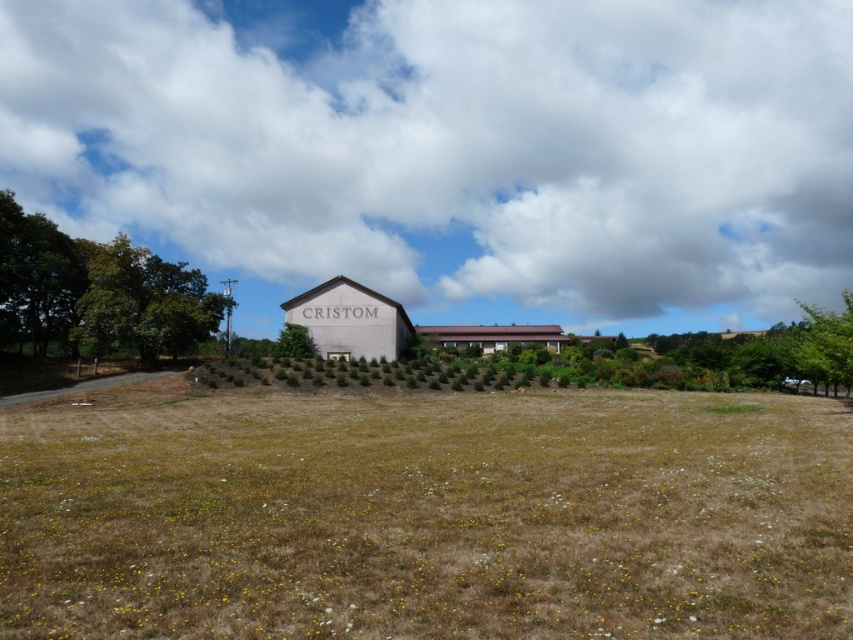
Question: Which point is farther from the camera taking this photo?

Choices:
 (A) (315, 332)
 (B) (521, 340)

Answer: (B)

Question: Which point is closer to the camera?

Choices:
 (A) (543, 337)
 (B) (288, 324)

Answer: (B)

Question: Is brown corrugated metal barn at center wider than green leafy tree at center?

Choices:
 (A) no
 (B) yes

Answer: (B)

Question: Considering the relative positions of white fluffy cloud at upper center and brown corrugated metal barn at center in the image provided, where is white fluffy cloud at upper center located with respect to brown corrugated metal barn at center?

Choices:
 (A) above
 (B) below

Answer: (A)

Question: Does brown grass at lower center appear on the right side of green leafy tree at left?

Choices:
 (A) no
 (B) yes

Answer: (B)

Question: Among these points, which one is nearest to the camera?

Choices:
 (A) (21, 252)
 (B) (303, 294)
 (C) (437, 253)

Answer: (A)